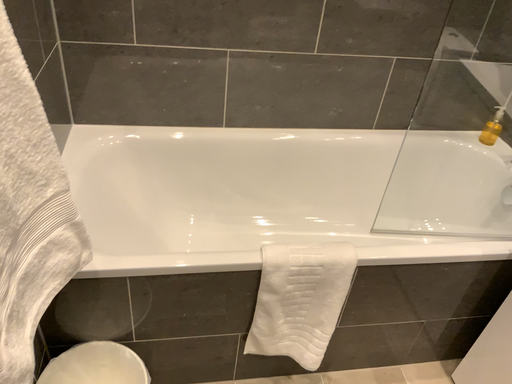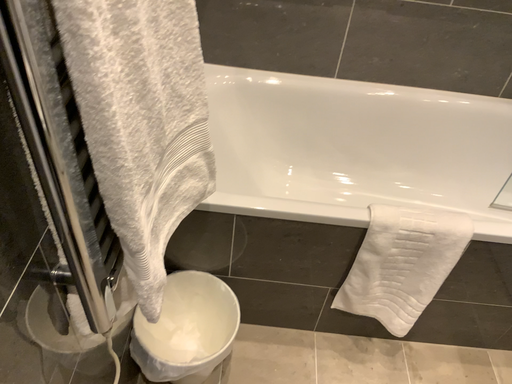
Question: How did the camera likely rotate when shooting the video?

Choices:
 (A) rotated left
 (B) rotated right

Answer: (A)